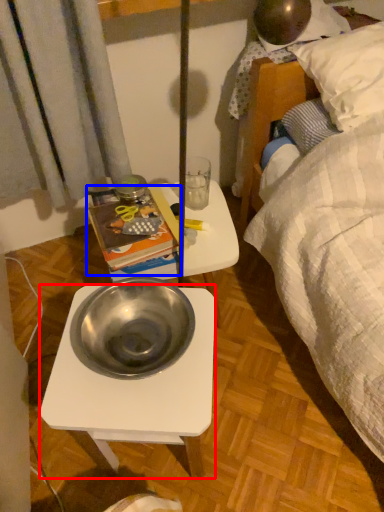
Question: Which point is closer to the camera, desk (highlighted by a red box) or paperback book (highlighted by a blue box)?

Choices:
 (A) desk
 (B) paperback book

Answer: (A)